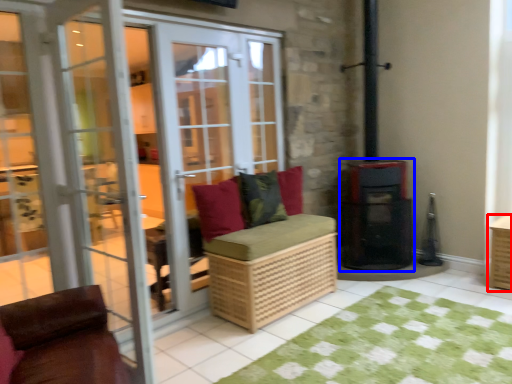
Question: Which of the following is the closest to the observer, crate (highlighted by a red box) or appliance (highlighted by a blue box)?

Choices:
 (A) crate
 (B) appliance

Answer: (A)